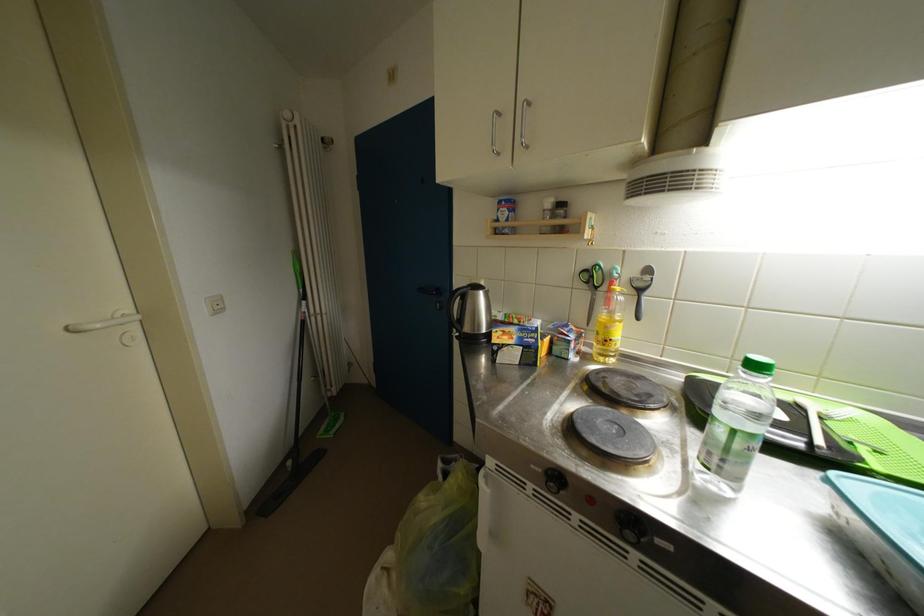
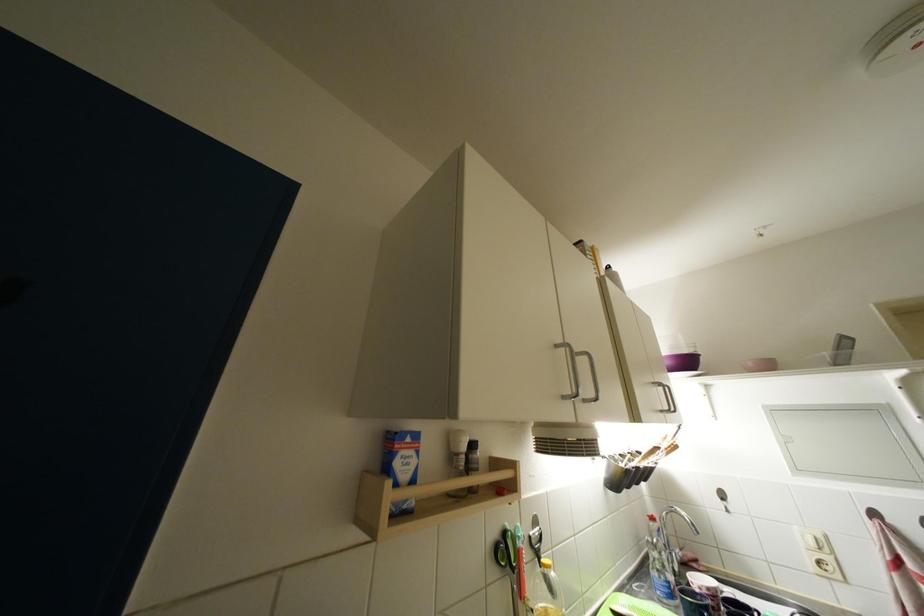
Where in the second image is the point corresponding to (x=505, y=217) from the first image?

(404, 467)